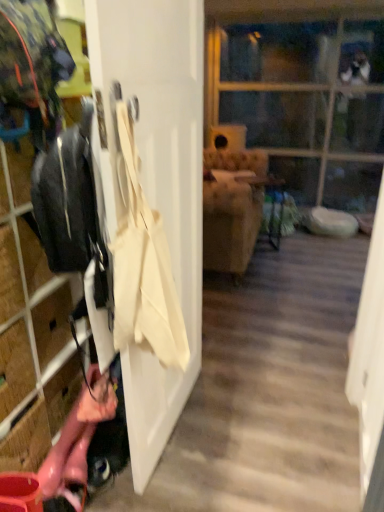
Question: Are beige canvas tote at left and white matte door at center beside each other?

Choices:
 (A) yes
 (B) no

Answer: (B)

Question: Does beige canvas tote at left appear on the right side of white matte door at center?

Choices:
 (A) no
 (B) yes

Answer: (A)

Question: From the image's perspective, is beige canvas tote at left beneath white matte door at center?

Choices:
 (A) yes
 (B) no

Answer: (A)

Question: Is white matte door at center a part of beige canvas tote at left?

Choices:
 (A) yes
 (B) no

Answer: (B)

Question: Is beige canvas tote at left closer to camera compared to white matte door at center?

Choices:
 (A) yes
 (B) no

Answer: (B)

Question: Considering the positions of white matte door at center and beige canvas tote at left in the image, is white matte door at center wider or thinner than beige canvas tote at left?

Choices:
 (A) thin
 (B) wide

Answer: (A)

Question: In terms of height, does white matte door at center look taller or shorter compared to beige canvas tote at left?

Choices:
 (A) tall
 (B) short

Answer: (A)

Question: Considering the positions of point (155, 66) and point (165, 285), is point (155, 66) closer or farther from the camera than point (165, 285)?

Choices:
 (A) closer
 (B) farther

Answer: (B)

Question: In terms of size, does white matte door at center appear bigger or smaller than beige canvas tote at left?

Choices:
 (A) big
 (B) small

Answer: (A)

Question: Is matte black jacket at left inside the boundaries of beige canvas tote at left, or outside?

Choices:
 (A) outside
 (B) inside

Answer: (A)

Question: Is matte black jacket at left wider or thinner than beige canvas tote at left?

Choices:
 (A) thin
 (B) wide

Answer: (B)

Question: From the image's perspective, is matte black jacket at left positioned above or below beige canvas tote at left?

Choices:
 (A) above
 (B) below

Answer: (B)

Question: In the image, is matte black jacket at left on the left side or the right side of beige canvas tote at left?

Choices:
 (A) left
 (B) right

Answer: (A)

Question: Considering the positions of transparent glass door at upper center and white matte door at center in the image, is transparent glass door at upper center bigger or smaller than white matte door at center?

Choices:
 (A) small
 (B) big

Answer: (B)

Question: Is transparent glass door at upper center taller or shorter than white matte door at center?

Choices:
 (A) short
 (B) tall

Answer: (B)